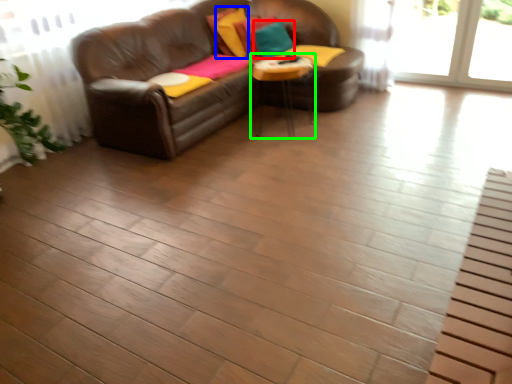
Question: Based on their relative distances, which object is nearer to pillow (highlighted by a red box)? Choose from pillow (highlighted by a blue box) and table (highlighted by a green box).

Choices:
 (A) pillow
 (B) table

Answer: (A)